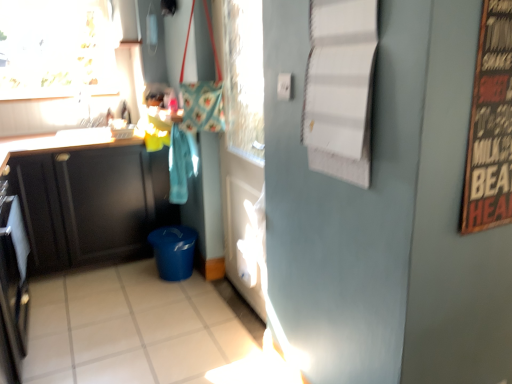
In order to click on free spot in front of white glossy door at center in this screenshot , I will do `click(220, 339)`.